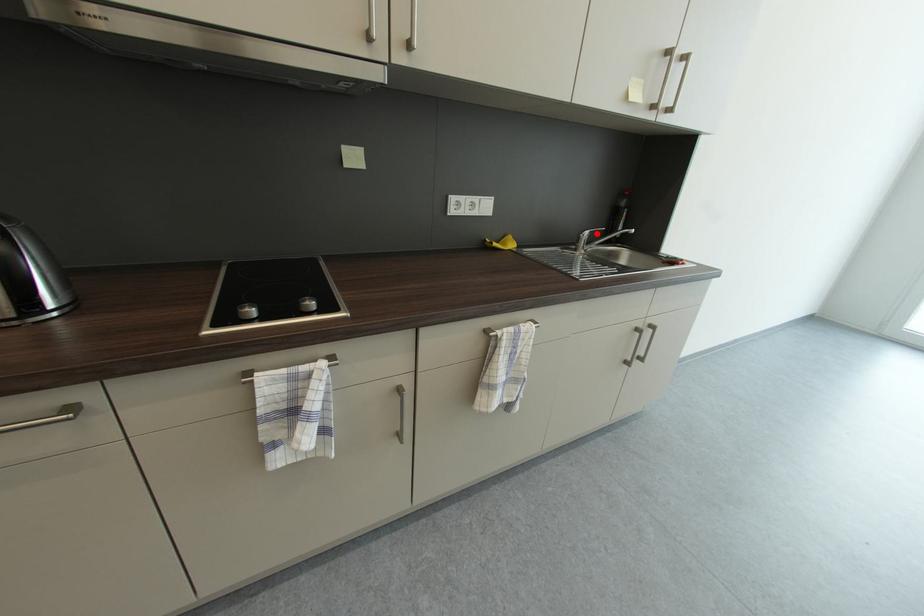
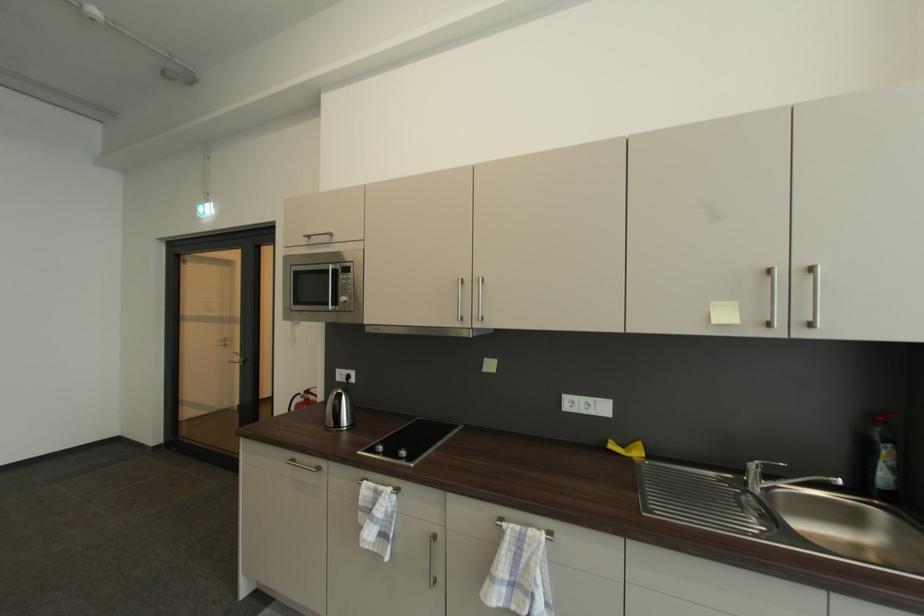
Find the pixel in the second image that matches the highlighted location in the first image.

(769, 466)